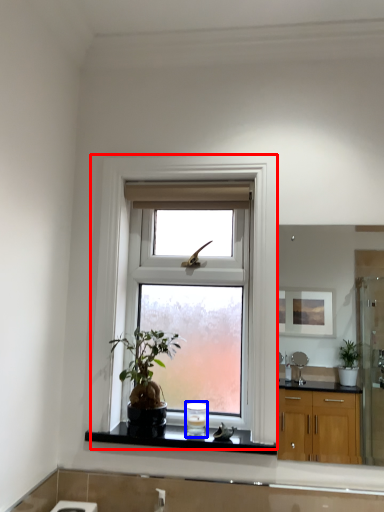
Question: Which of the following is the closest to the observer, window (highlighted by a red box) or appliance (highlighted by a blue box)?

Choices:
 (A) window
 (B) appliance

Answer: (A)